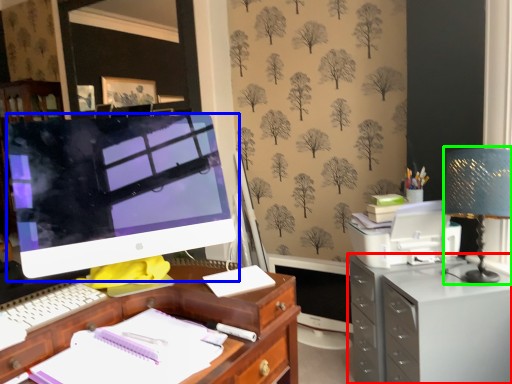
Question: Estimate the real-world distances between objects in this image. Which object is closer to filing cabinet (highlighted by a red box), computer monitor (highlighted by a blue box) or table lamp (highlighted by a green box)?

Choices:
 (A) computer monitor
 (B) table lamp

Answer: (B)